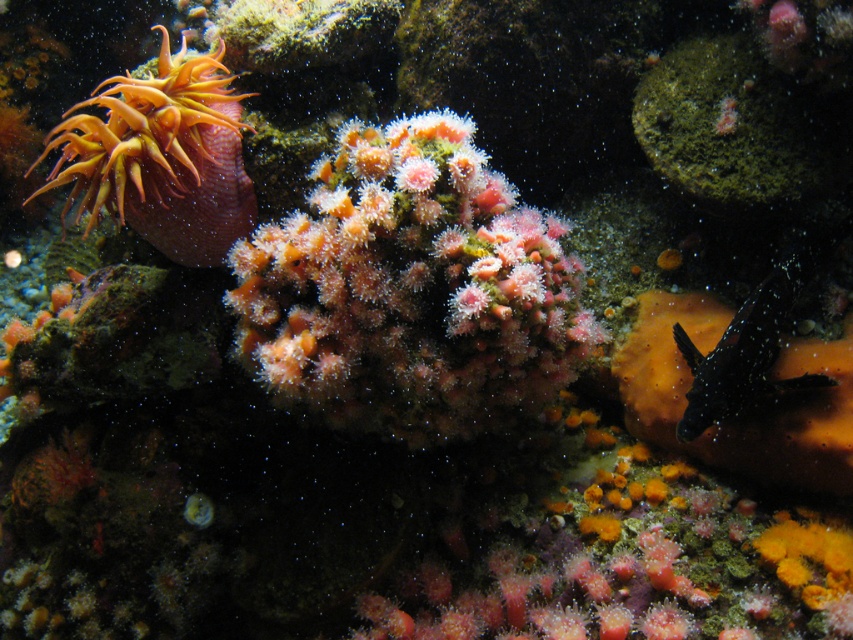
You are a marine biologist observing an underwater scene. You notice the pink fuzzy coral at center and the black dotted clownfish at right. Which object is wider?

The pink fuzzy coral at center is wider than the black dotted clownfish at right.

You are a marine biologist studying coral reefs. You observe the pink fuzzy coral at center and the orange soft coral at upper left in the scene. Which of these corals has a larger size?

The orange soft coral at upper left is larger than the pink fuzzy coral at center.